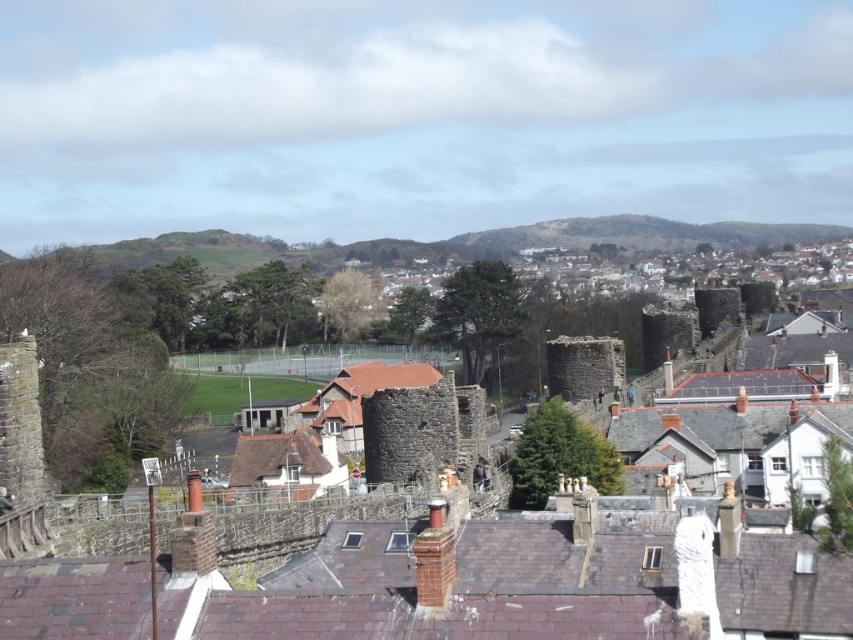
Does point (329, 628) lie in front of point (384, 440)?

Yes, point (329, 628) is in front of point (384, 440).

This screenshot has height=640, width=853. Identify the location of stone wall at center. click(509, 577).

Is point (637, 595) closer to viewer compared to point (289, 435)?

Yes, point (637, 595) is in front of point (289, 435).

Where is `stone wall at center`? stone wall at center is located at coordinates (509, 577).